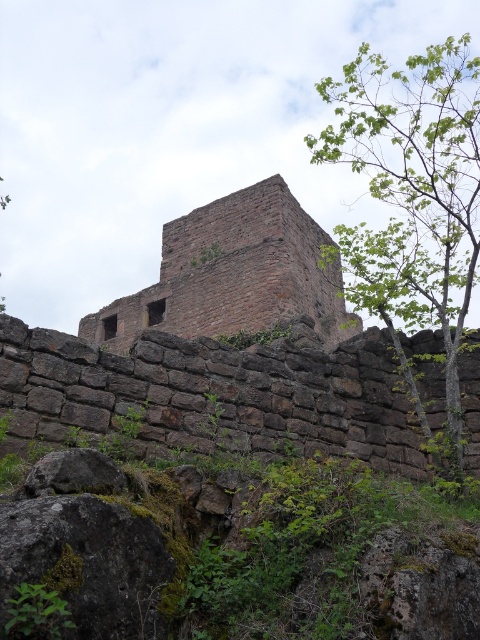
Looking at this image, you are an archaeologist examining the ancient stone structure. You notice the brown stone wall at center and the green leafy tree at upper right. Which object occupies a larger area in the image?

The green leafy tree at upper right is larger in size compared to the brown stone wall at center, so it occupies a larger area in the image.

You are standing at the base of the ancient stone tower and notice two points marked on the structure. The first point is at coordinate point(387, 381) and the second is at point(238, 266). Which point would appear larger in your field of view?

Point(387, 381) is closer to the camera than point(238, 266), so it would appear larger in your field of view.

You are standing in front of the ancient stone structure and want to determine the relative positions of two points marked on the image. Which point is closer to you, point (431,61) or point (207,218)?

Point (431,61) is closer to the viewer than point (207,218).